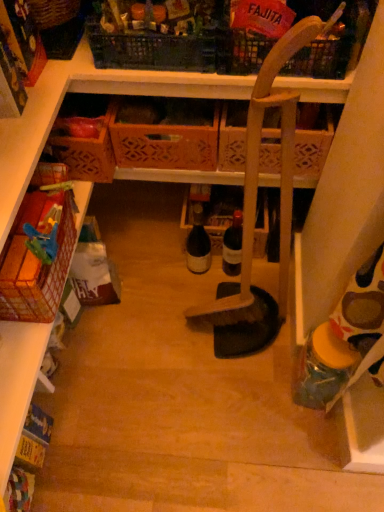
At what (x,y) coordinates should I click in order to perform the action: click on blank space to the left of translucent plastic jar at lower right, the second bottle viewed from the back. Please return your answer as a coordinate pair (x, y). Looking at the image, I should click on (260, 389).